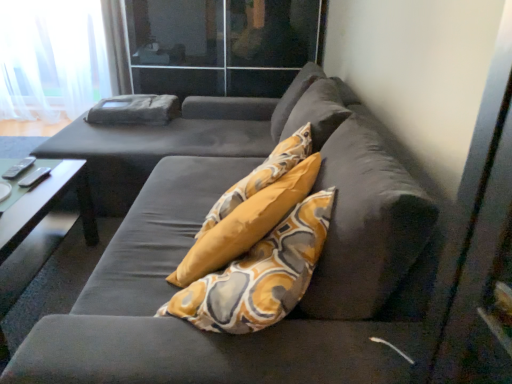
Question: Considering their positions, is transparent glass door at upper center located in front of or behind green glossy table at lower left?

Choices:
 (A) behind
 (B) front

Answer: (A)

Question: Choose the correct answer: Is transparent glass door at upper center inside green glossy table at lower left or outside it?

Choices:
 (A) inside
 (B) outside

Answer: (B)

Question: Which is nearer to the transparent glass door at upper center?

Choices:
 (A) velvet dark gray couch at center
 (B) white sheer curtain at upper left
 (C) green glossy table at lower left

Answer: (B)

Question: Which is nearer to the green glossy table at lower left?

Choices:
 (A) white sheer curtain at upper left
 (B) transparent glass door at upper center
 (C) velvet dark gray couch at center

Answer: (C)